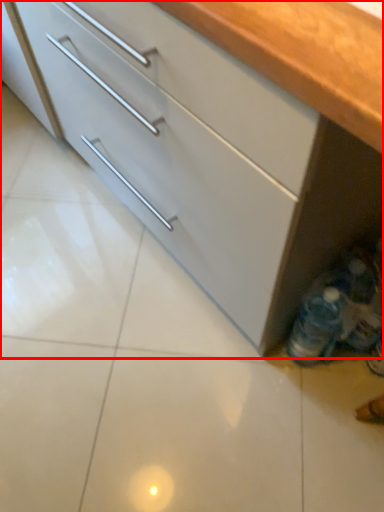
Question: From the image, what is the correct spatial relationship of cabinetry (annotated by the red box) in relation to bottle?

Choices:
 (A) left
 (B) right

Answer: (A)